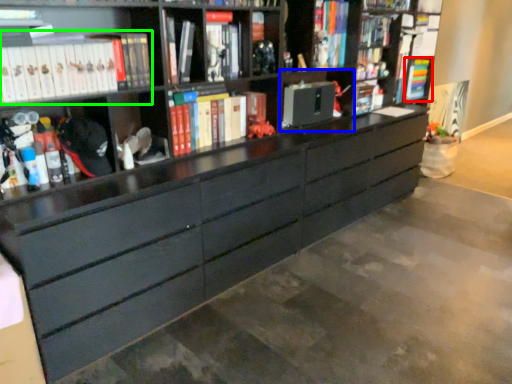
Question: Based on their relative distances, which object is farther from book (highlighted by a red box)? Choose from cabinet (highlighted by a blue box) and book (highlighted by a green box).

Choices:
 (A) cabinet
 (B) book

Answer: (B)